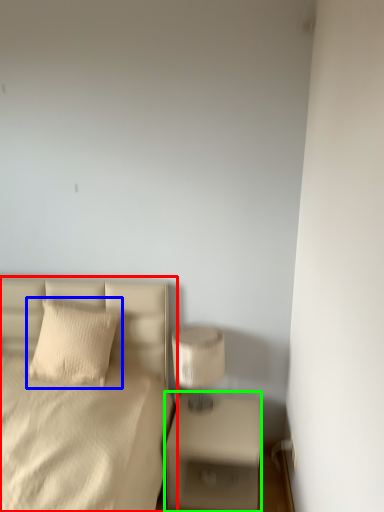
Question: Which object is the closest to the bed (highlighted by a red box)? Choose among these: pillow (highlighted by a blue box) or nightstand (highlighted by a green box).

Choices:
 (A) pillow
 (B) nightstand

Answer: (A)